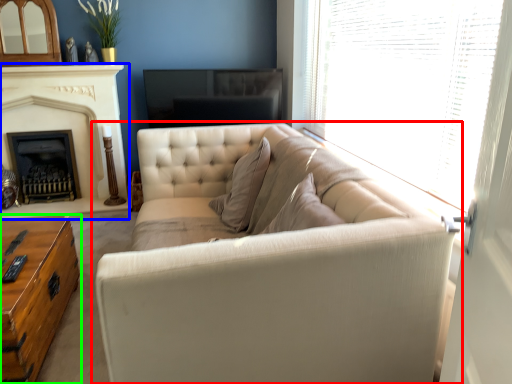
Question: Which is farther away from studio couch (highlighted by a red box)? fireplace (highlighted by a blue box) or table (highlighted by a green box)?

Choices:
 (A) fireplace
 (B) table

Answer: (A)